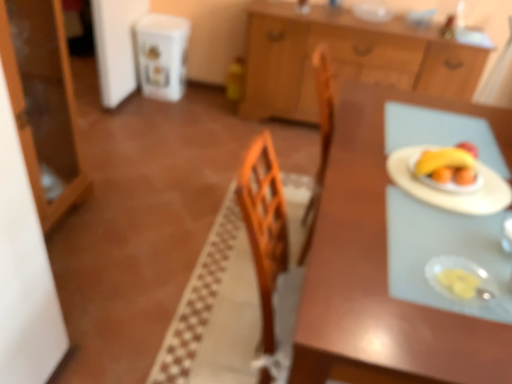
This screenshot has width=512, height=384. Find the location of `vacant space in front of white paper plate at right`. vacant space in front of white paper plate at right is located at coordinates (429, 236).